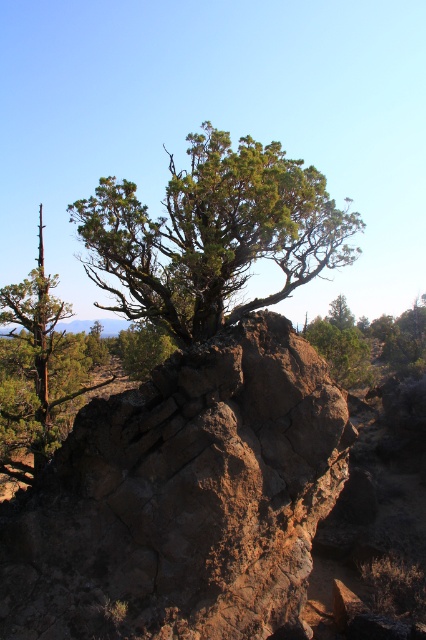
Can you confirm if brown rough rock at center is positioned above green leafy tree at center?

Actually, brown rough rock at center is below green leafy tree at center.

Can you confirm if brown rough rock at center is wider than green leafy tree at center?

Incorrect, brown rough rock at center's width does not surpass green leafy tree at center's.

Describe the element at coordinates (184, 497) in the screenshot. This screenshot has height=640, width=426. I see `brown rough rock at center` at that location.

The width and height of the screenshot is (426, 640). Find the location of `brown rough rock at center`. brown rough rock at center is located at coordinates (184, 497).

Based on the photo, who is taller, brown rough rock at center or green rough textured tree at center?

green rough textured tree at center is taller.

Between brown rough rock at center and green rough textured tree at center, which one has less height?

brown rough rock at center

What are the coordinates of `brown rough rock at center` in the screenshot? It's located at (184, 497).

Where is `brown rough rock at center`? Image resolution: width=426 pixels, height=640 pixels. brown rough rock at center is located at coordinates (184, 497).

Does point (213, 308) come closer to viewer compared to point (351, 332)?

Yes, it is.

Where is `green leafy tree at center`? The width and height of the screenshot is (426, 640). green leafy tree at center is located at coordinates (212, 234).

What are the coordinates of `green leafy tree at center` in the screenshot? It's located at (212, 234).

This screenshot has width=426, height=640. I want to click on green leafy tree at center, so click(x=212, y=234).